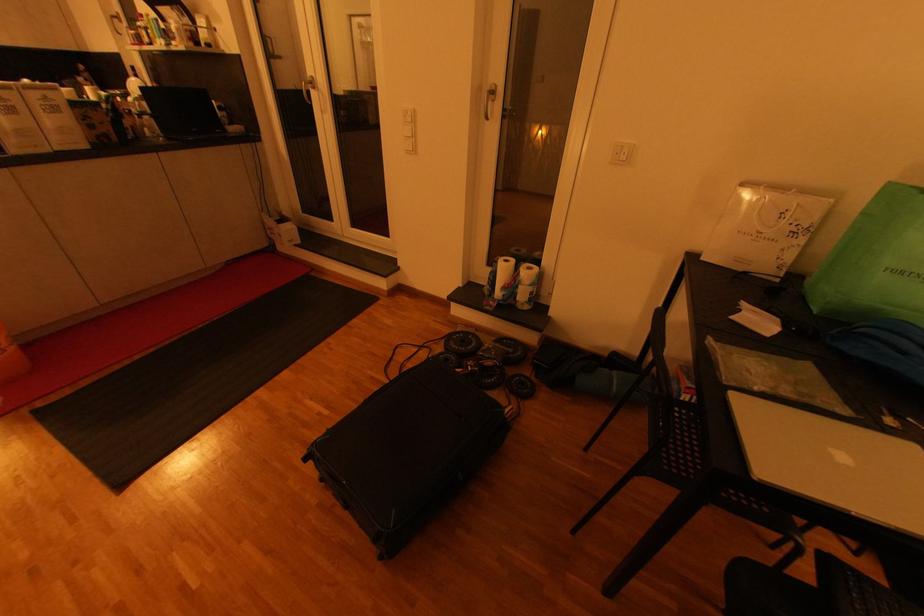
This screenshot has height=616, width=924. What do you see at coordinates (772, 212) in the screenshot?
I see `a paper bag handle` at bounding box center [772, 212].